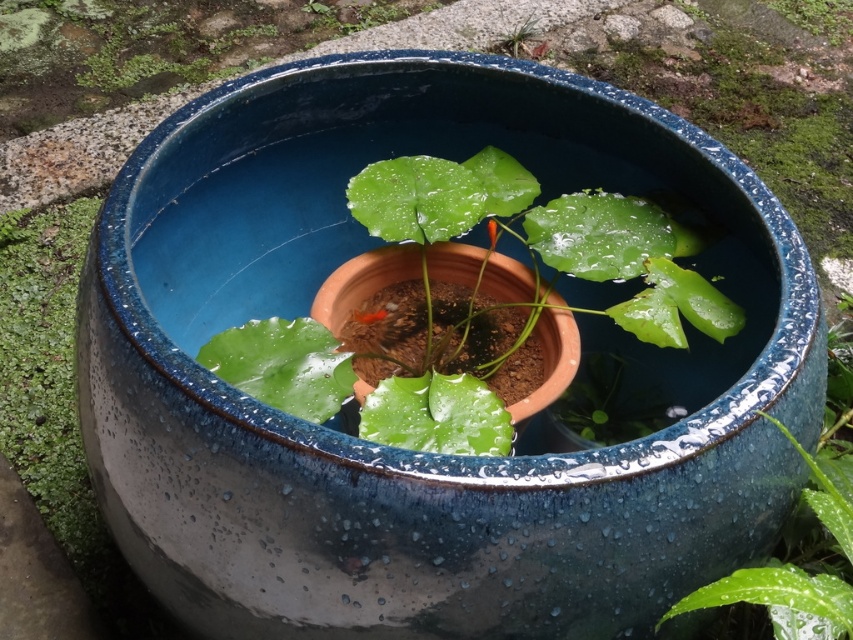
Question: Which object is the closest to the green glossy leaf at upper center?

Choices:
 (A) green moss at left
 (B) glossy green leaf at lower right

Answer: (B)

Question: Is glossy green leaf at lower right bigger than green glossy leaf at upper center?

Choices:
 (A) no
 (B) yes

Answer: (B)

Question: Which object is closer to the camera taking this photo?

Choices:
 (A) glossy green leaf at lower right
 (B) green moss at left
 (C) green matte plant at upper center
 (D) green glossy leaf at upper center

Answer: (A)

Question: Is green glossy leaves at center to the left of glossy green leaf at lower right from the viewer's perspective?

Choices:
 (A) no
 (B) yes

Answer: (B)

Question: Does green moss at left appear on the right side of green glossy leaf at upper center?

Choices:
 (A) no
 (B) yes

Answer: (A)

Question: Estimate the real-world distances between objects in this image. Which object is farther from the green moss at left?

Choices:
 (A) green matte plant at upper center
 (B) green glossy leaves at center
 (C) glossy green leaf at lower right
 (D) green glossy leaf at upper center

Answer: (D)